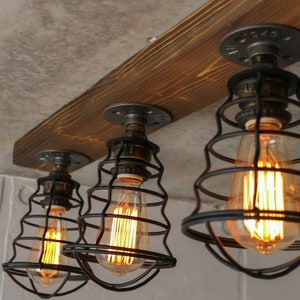
Locate an element on the screen. light bulbs is located at coordinates (50, 248), (119, 230), (264, 191).